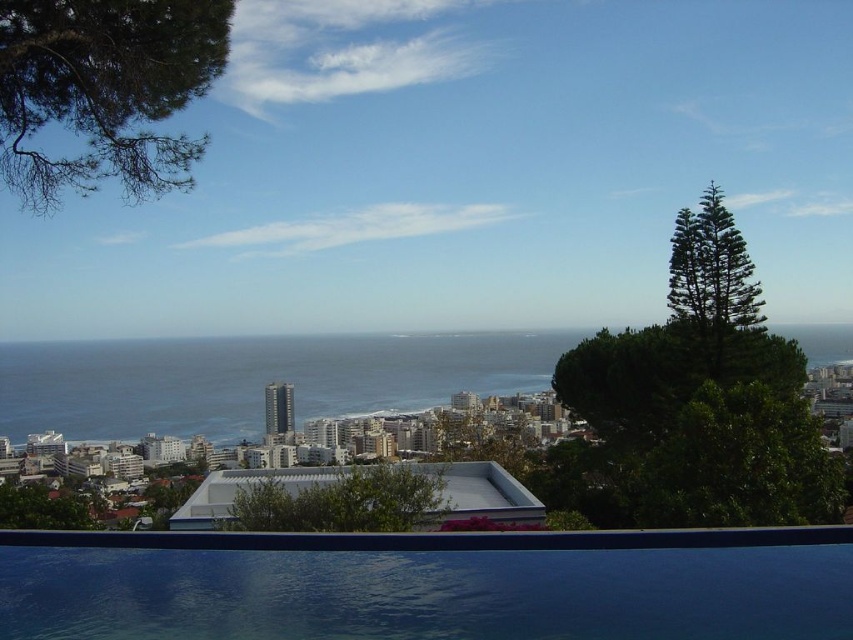
You are standing at the edge of the infinity pool in the coastal cityscape scene. You notice two points marked in the image. The first point is at coordinates point (711, 636) and the second is at point (502, 392). Which of these points is closer to you as you stand at the pool edge?

Point (711, 636) is in front of point (502, 392), so it is closer to you as you stand at the pool edge.

You are standing at the edge of the dark blue smooth pool at lower center and want to walk to the blue water at center. Which direction should you head towards?

Since the dark blue smooth pool at lower center is to the right of the blue water at center, you should head towards the left to reach the blue water at center.